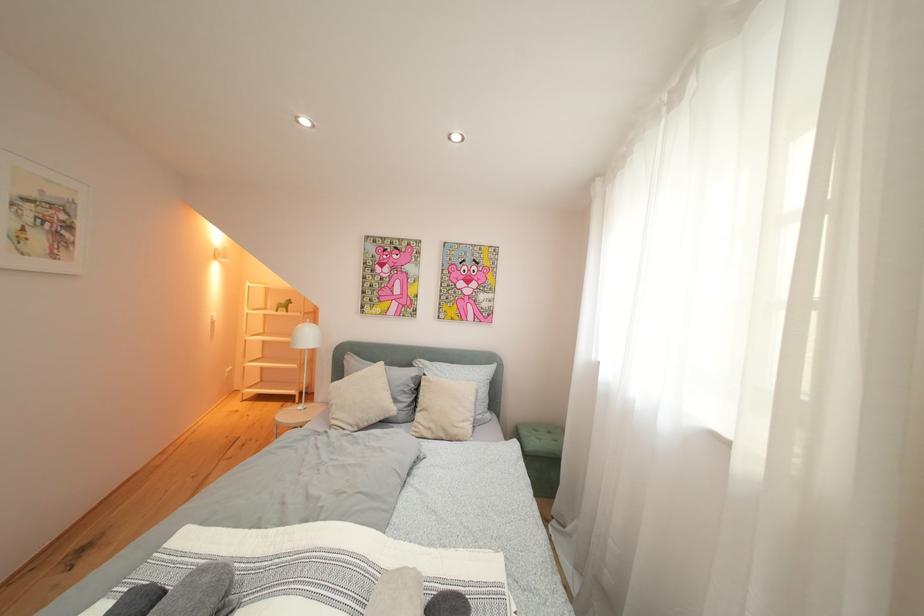
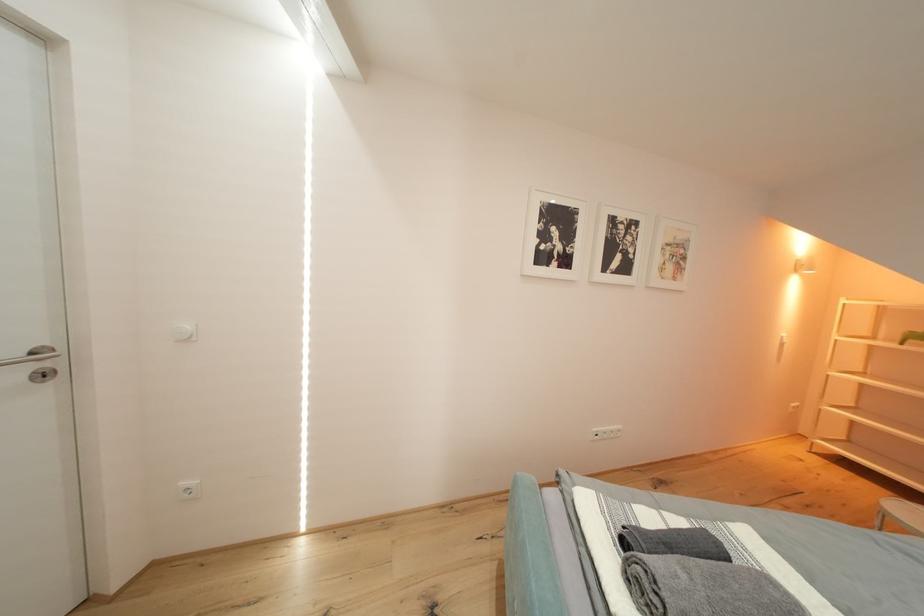
Question: The first image is from the beginning of the video and the second image is from the end. How did the camera likely rotate when shooting the video?

Choices:
 (A) Left
 (B) Right
 (C) Up
 (D) Down

Answer: (A)